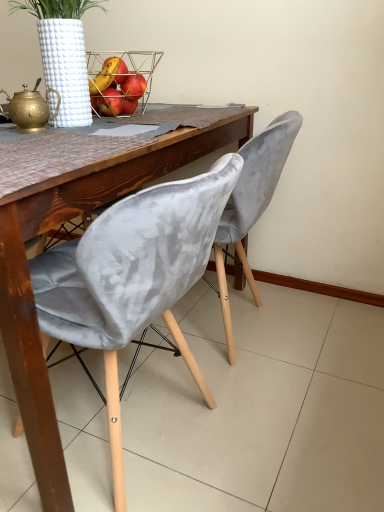
Question: Is metallic wire basket at upper center facing away from velvet grey chair at center, which ranks as the 1th chair in front-to-back order?

Choices:
 (A) no
 (B) yes

Answer: (A)

Question: Can you confirm if metallic wire basket at upper center is taller than velvet grey chair at center, which ranks as the 1th chair in front-to-back order?

Choices:
 (A) no
 (B) yes

Answer: (A)

Question: Would you say metallic wire basket at upper center is a long distance from velvet grey chair at center, which ranks as the 1th chair in front-to-back order?

Choices:
 (A) no
 (B) yes

Answer: (A)

Question: Is metallic wire basket at upper center to the right of velvet grey chair at center, which ranks as the 1th chair in front-to-back order, from the viewer's perspective?

Choices:
 (A) no
 (B) yes

Answer: (A)

Question: Is the position of metallic wire basket at upper center more distant than that of velvet grey chair at center, positioned as the second chair in back-to-front order?

Choices:
 (A) yes
 (B) no

Answer: (A)

Question: Can you confirm if metallic wire basket at upper center is thinner than velvet grey chair at center, which ranks as the 1th chair in front-to-back order?

Choices:
 (A) yes
 (B) no

Answer: (A)

Question: Is velvet grey chair at center, positioned as the second chair in back-to-front order, closer to the viewer compared to velvet grey chair at center, which is the 1th chair in back-to-front order?

Choices:
 (A) yes
 (B) no

Answer: (A)

Question: Is there a large distance between velvet grey chair at center, positioned as the second chair in back-to-front order, and velvet grey chair at center, acting as the second chair starting from the front?

Choices:
 (A) yes
 (B) no

Answer: (B)

Question: Can you confirm if velvet grey chair at center, which ranks as the 1th chair in front-to-back order, is smaller than velvet grey chair at center, acting as the second chair starting from the front?

Choices:
 (A) no
 (B) yes

Answer: (A)

Question: Can you confirm if velvet grey chair at center, positioned as the second chair in back-to-front order, is thinner than velvet grey chair at center, which is the 1th chair in back-to-front order?

Choices:
 (A) no
 (B) yes

Answer: (A)

Question: Considering the relative positions of velvet grey chair at center, positioned as the second chair in back-to-front order, and velvet grey chair at center, which is the 1th chair in back-to-front order, in the image provided, is velvet grey chair at center, positioned as the second chair in back-to-front order, to the left of velvet grey chair at center, which is the 1th chair in back-to-front order, from the viewer's perspective?

Choices:
 (A) no
 (B) yes

Answer: (B)

Question: From the image's perspective, would you say velvet grey chair at center, positioned as the second chair in back-to-front order, is shown under velvet grey chair at center, acting as the second chair starting from the front?

Choices:
 (A) yes
 (B) no

Answer: (A)

Question: Is velvet grey chair at center, which ranks as the 1th chair in front-to-back order, at the back of velvet grey chair at center, acting as the second chair starting from the front?

Choices:
 (A) yes
 (B) no

Answer: (B)